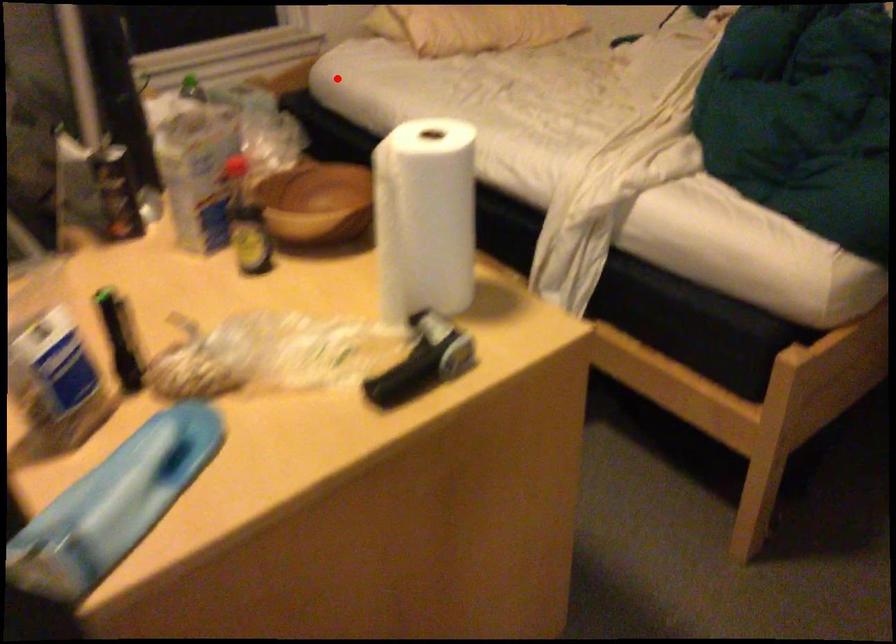
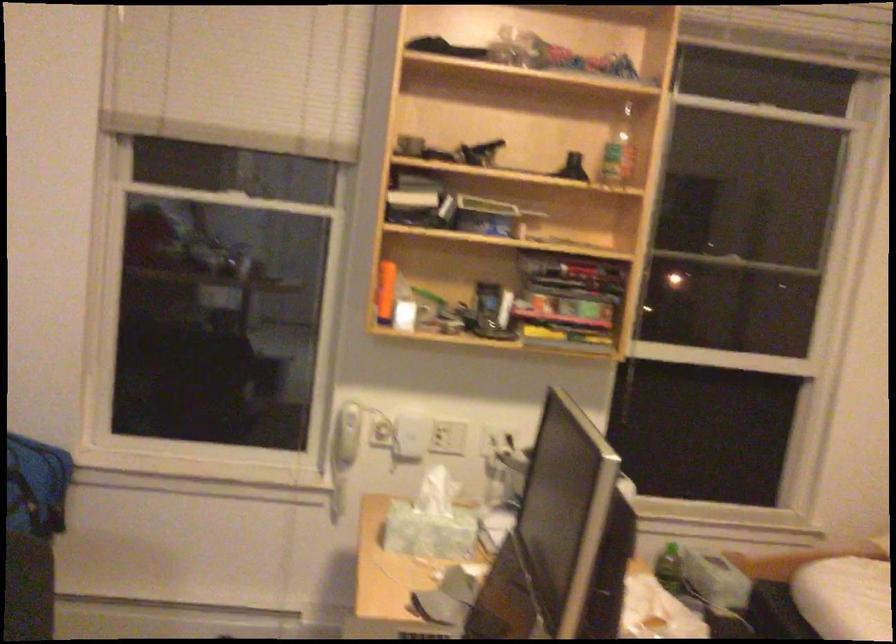
Locate, in the second image, the point that corresponds to the highlighted location in the first image.

(845, 598)